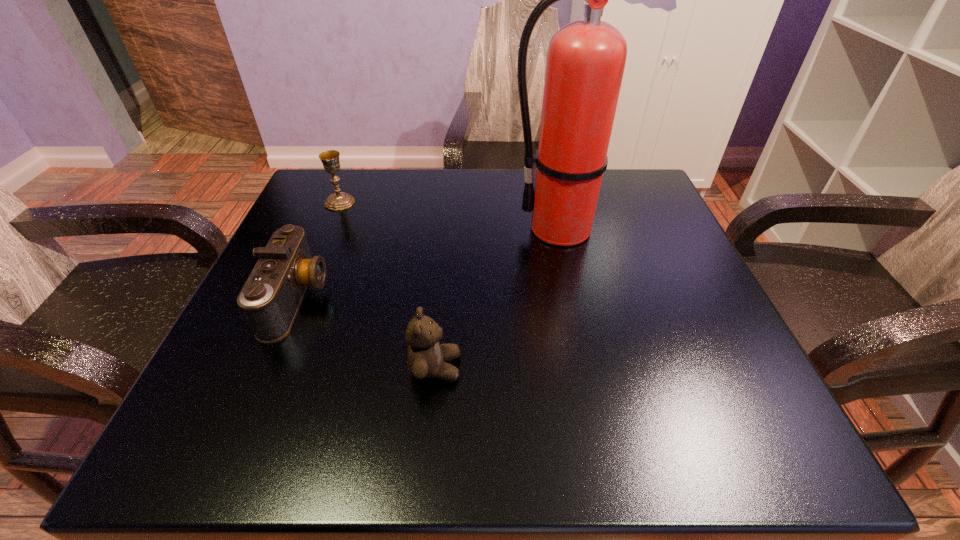
You are a GUI agent. You are given a task and a screenshot of the screen. Output one action in this format:
    pyautogui.click(x=<x>, y=<y>)
    Task: Click on the tallest object
    This screenshot has width=960, height=540.
    Given the screenshot: What is the action you would take?
    pyautogui.click(x=586, y=59)

Where is `the rightmost object`? The height and width of the screenshot is (540, 960). the rightmost object is located at coordinates (586, 59).

You are a GUI agent. You are given a task and a screenshot of the screen. Output one action in this format:
    pyautogui.click(x=<x>, y=<y>)
    Task: Click on the chalice
    
    Given the screenshot: What is the action you would take?
    pyautogui.click(x=339, y=200)

Locate an element on the screen. teddy bear is located at coordinates (426, 357).

The height and width of the screenshot is (540, 960). Find the location of `camera`. camera is located at coordinates (271, 297).

Image resolution: width=960 pixels, height=540 pixels. Find the location of `free space located 0.240m on the hose direction of the tallest object`. free space located 0.240m on the hose direction of the tallest object is located at coordinates (398, 228).

At what (x,y) coordinates should I click in order to perform the action: click on vacant space located on the hose direction of the tallest object. Please return your answer as a coordinate pair (x, y). This screenshot has height=540, width=960. Looking at the image, I should click on (403, 228).

The width and height of the screenshot is (960, 540). Identify the location of free space located on the hose direction of the tallest object. (476, 228).

Image resolution: width=960 pixels, height=540 pixels. I want to click on vacant region located on the front of the chalice, so click(329, 226).

Where is `free space located 0.400m on the face of the second object from right to left`? free space located 0.400m on the face of the second object from right to left is located at coordinates (715, 368).